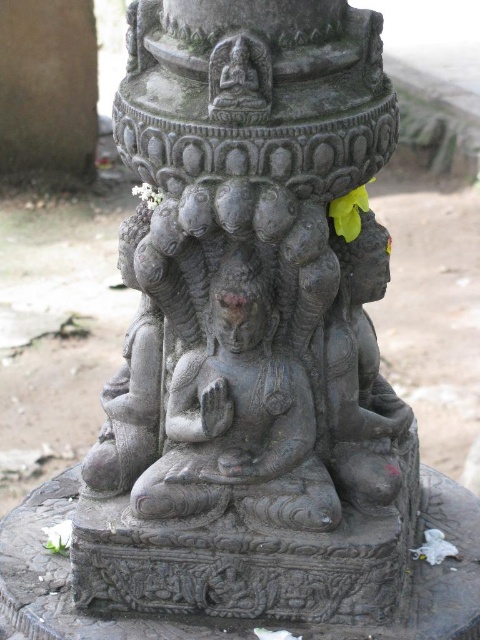
You are an interior designer planning to place a decorative item between the white paper flower at lower left and the white matte flower at center. Given that the space between them is 41.17 centimeters, what is the maximum width your decorative item can have without overlapping either flower?

The maximum width your decorative item can have is 41.17 centimeters, as that is the exact distance between the white paper flower at lower left and the white matte flower at center. However, to ensure it fits without overlapping, you should consider leaving a small gap, so the ideal width would be slightly less than 41.17 centimeters.